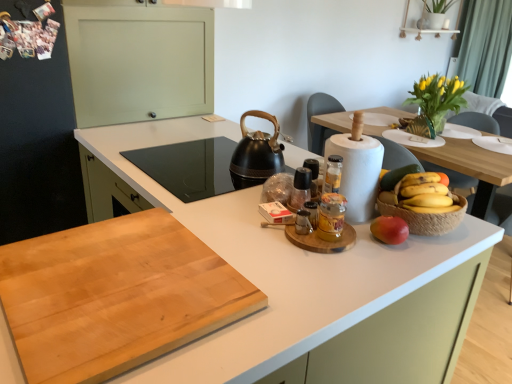
You are a GUI agent. You are given a task and a screenshot of the screen. Output one action in this format:
    pyautogui.click(x=<x>, y=<y>)
    Task: Click on the free point above white matte countertop at center, the second countertop positioned from the top (from a real-world perspective)
    The height and width of the screenshot is (384, 512).
    Given the screenshot: What is the action you would take?
    pyautogui.click(x=192, y=271)